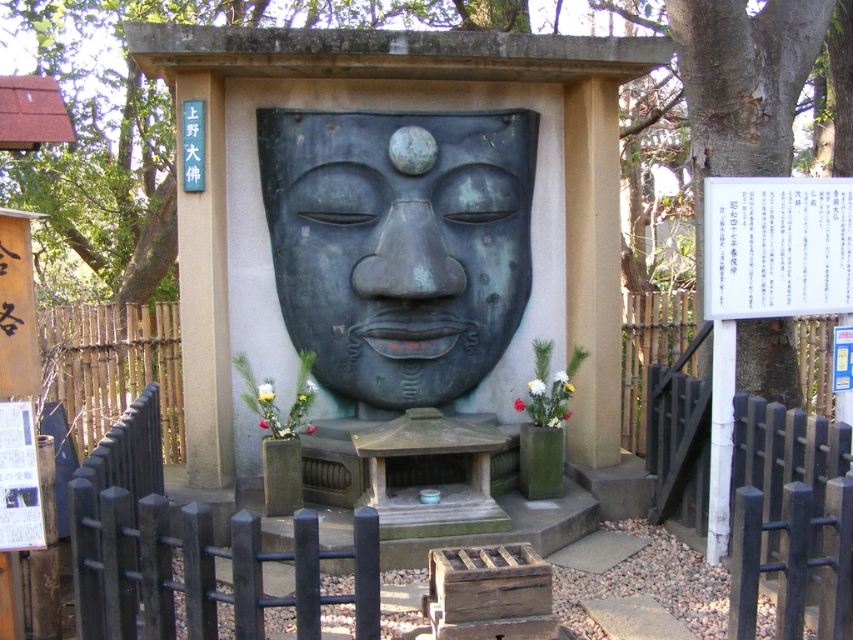
Does bronze mask at center appear over black wooden fence at center?

Yes.

Can you confirm if bronze mask at center is bigger than black wooden fence at center?

Indeed, bronze mask at center has a larger size compared to black wooden fence at center.

Locate an element on the screen. The image size is (853, 640). bronze mask at center is located at coordinates (399, 244).